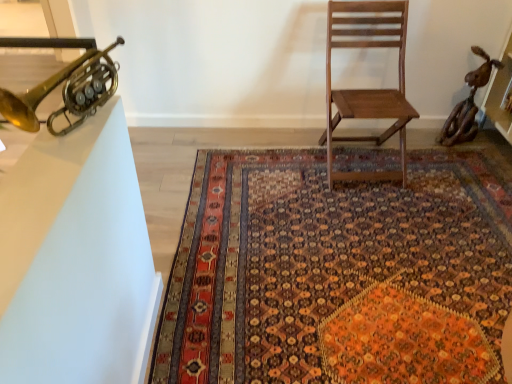
Question: Is white glossy table at left bigger or smaller than gold brass trumpet at upper left?

Choices:
 (A) big
 (B) small

Answer: (B)

Question: In terms of height, does white glossy table at left look taller or shorter compared to gold brass trumpet at upper left?

Choices:
 (A) short
 (B) tall

Answer: (A)

Question: Which is farther from the white glossy table at left?

Choices:
 (A) wooden chair at center
 (B) gold brass trumpet at upper left
 (C) carpet with intricate patterns at center

Answer: (A)

Question: Which object is positioned farthest from the wooden chair at center?

Choices:
 (A) white glossy table at left
 (B) gold brass trumpet at upper left
 (C) carpet with intricate patterns at center

Answer: (B)